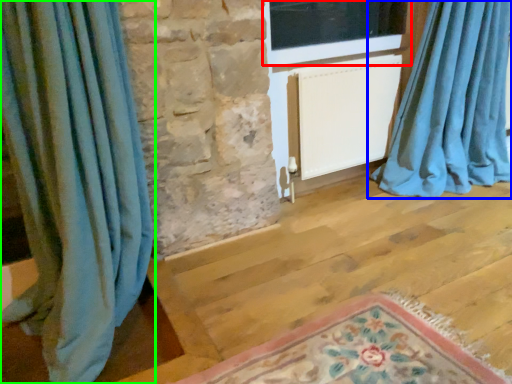
Question: Considering the real-world distances, which object is closest to window (highlighted by a red box)? curtain (highlighted by a blue box) or curtain (highlighted by a green box).

Choices:
 (A) curtain
 (B) curtain

Answer: (A)